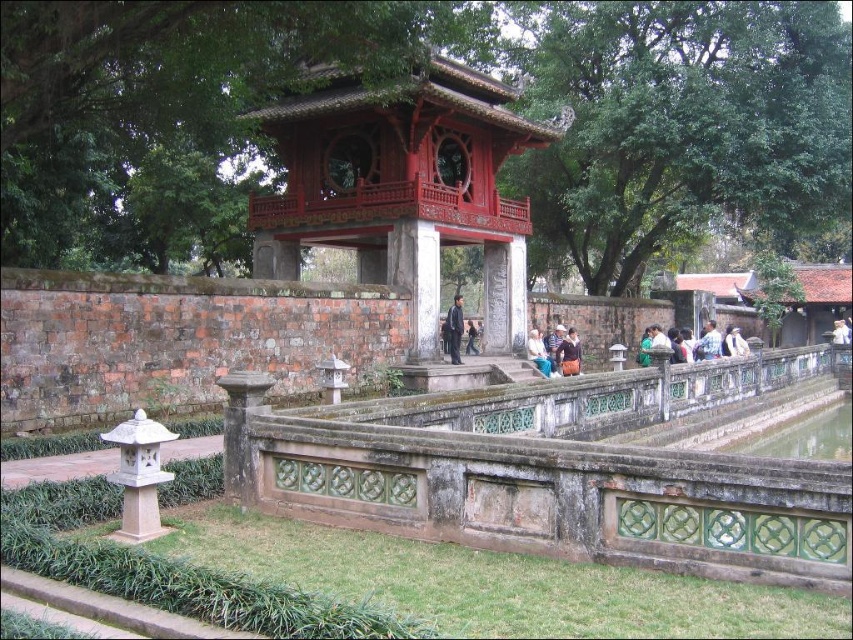
Is the position of white textured fabric at center less distant than that of dark blue jeans at center?

No, white textured fabric at center is further to the viewer.

This screenshot has height=640, width=853. What do you see at coordinates (555, 353) in the screenshot? I see `white textured fabric at center` at bounding box center [555, 353].

The width and height of the screenshot is (853, 640). In order to click on white textured fabric at center in this screenshot , I will do `click(555, 353)`.

Can you confirm if brown leather jacket at lower right is bigger than white textured fabric at center?

Indeed, brown leather jacket at lower right has a larger size compared to white textured fabric at center.

Describe the element at coordinates (699, 344) in the screenshot. I see `brown leather jacket at lower right` at that location.

Find the location of a particular element. brown leather jacket at lower right is located at coordinates (699, 344).

Which is more to the left, dark blue jeans at center or dark blue fabric jacket at lower center?

dark blue jeans at center is more to the left.

Which is above, dark blue jeans at center or dark blue fabric jacket at lower center?

Positioned higher is dark blue jeans at center.

Which is behind, point (445, 320) or point (560, 355)?

The point (560, 355) is behind.

Where is `dark blue jeans at center`? dark blue jeans at center is located at coordinates (454, 330).